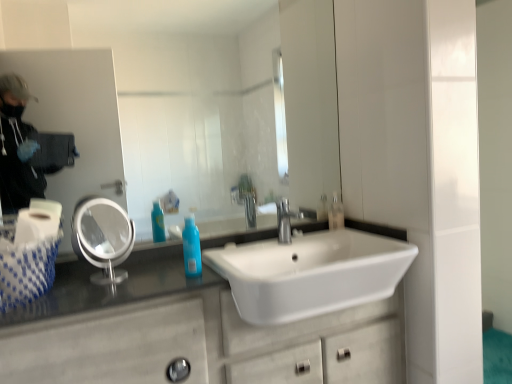
Where is `vacant space to the left of silver metallic faucet at center`? The width and height of the screenshot is (512, 384). vacant space to the left of silver metallic faucet at center is located at coordinates (242, 244).